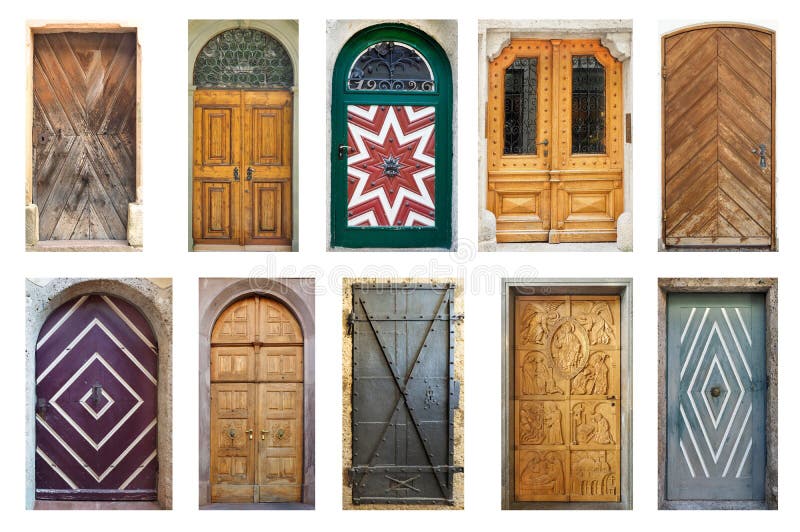
This screenshot has height=532, width=800. Identify the location of handles. (265, 431), (252, 430), (44, 406), (250, 173), (238, 178), (345, 151), (544, 143), (766, 152), (616, 402).